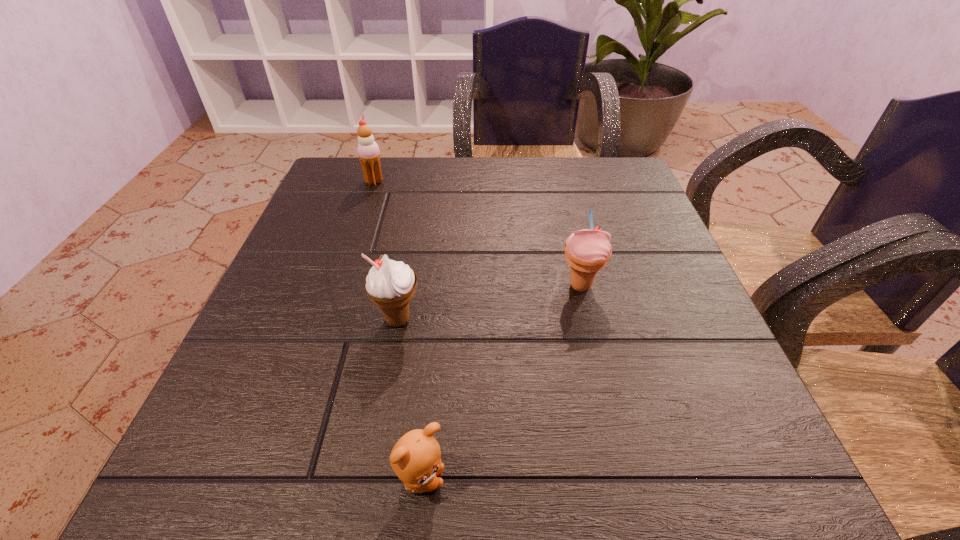
This screenshot has height=540, width=960. What are the coordinates of `the farthest object` in the screenshot? It's located at (368, 151).

The height and width of the screenshot is (540, 960). Identify the location of the leftmost icecream. (368, 151).

I want to click on the third farthest object, so click(x=390, y=284).

The height and width of the screenshot is (540, 960). What are the coordinates of `the second icecream from right to left` in the screenshot? It's located at (390, 284).

This screenshot has height=540, width=960. In order to click on the second farthest object in this screenshot , I will do `click(587, 251)`.

At what (x,y) coordinates should I click in order to perform the action: click on the second nearest icecream. Please return your answer as a coordinate pair (x, y). Image resolution: width=960 pixels, height=540 pixels. Looking at the image, I should click on (587, 251).

I want to click on teddy bear, so click(x=416, y=458).

Find the location of a particular element. The image size is (960, 540). the nearest object is located at coordinates (416, 458).

The image size is (960, 540). I want to click on vacant region located at the front with a straw on the leftmost object, so click(502, 181).

At what (x,y) coordinates should I click in order to perform the action: click on free location located on the back of the nearest icecream. Please return your answer as a coordinate pair (x, y). Looking at the image, I should click on (409, 259).